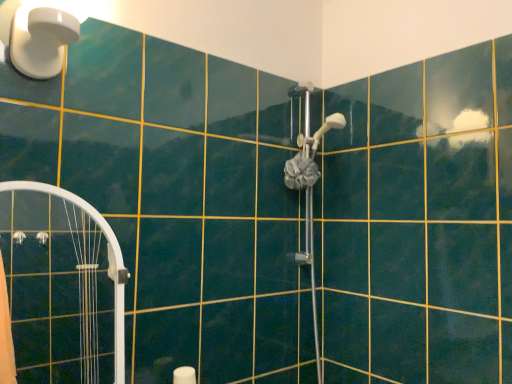
What is the approximate height of satin silver shower head at center, marked as the second shower in a top-to-bottom arrangement?

satin silver shower head at center, marked as the second shower in a top-to-bottom arrangement, is 1.08 meters in height.

What are the coordinates of `satin silver shower head at center, positioned as the 2th shower in bottom-to-top order` in the screenshot? It's located at (309, 156).

Based on the photo, are white glossy shower door at left and satin silver shower head at center, positioned as the 2th shower in bottom-to-top order, beside each other?

No, white glossy shower door at left is not touching satin silver shower head at center, positioned as the 2th shower in bottom-to-top order.

Which is closer to the camera, (56, 187) or (303, 154)?

The point (56, 187) is closer.

Considering the relative sizes of white glossy shower door at left and satin silver shower head at center, positioned as the 2th shower in bottom-to-top order, in the image provided, is white glossy shower door at left smaller than satin silver shower head at center, positioned as the 2th shower in bottom-to-top order,?

Actually, white glossy shower door at left might be larger than satin silver shower head at center, positioned as the 2th shower in bottom-to-top order.

Who is more distant, white glossy shower door at left or satin silver shower head at center, positioned as the 1th shower in top-to-bottom order?

satin silver shower head at center, positioned as the 1th shower in top-to-bottom order.

Looking at their sizes, would you say white plastic light fixture at upper left is wider or thinner than satin silver shower head at center, positioned as the 1th shower in top-to-bottom order?

In the image, white plastic light fixture at upper left appears to be wider than satin silver shower head at center, positioned as the 1th shower in top-to-bottom order.

From the image's perspective, is white plastic light fixture at upper left located above or below satin silver shower head at center, positioned as the 1th shower in top-to-bottom order?

From the image's perspective, white plastic light fixture at upper left appears above satin silver shower head at center, positioned as the 1th shower in top-to-bottom order.

Considering their positions, is white plastic light fixture at upper left located in front of or behind satin silver shower head at center, positioned as the 2th shower in bottom-to-top order?

Visually, white plastic light fixture at upper left is located in front of satin silver shower head at center, positioned as the 2th shower in bottom-to-top order.

How different are the orientations of white plastic light fixture at upper left and satin silver shower head at center, positioned as the 1th shower in top-to-bottom order, in degrees?

1.2 degrees.

Who is more distant, satin silver shower head at center, marked as the second shower in a top-to-bottom arrangement, or white plastic light fixture at upper left?

Positioned behind is satin silver shower head at center, marked as the second shower in a top-to-bottom arrangement.

Is point (298, 172) more distant than point (59, 44)?

Yes, it is.

Can you see satin silver shower head at center, marked as the first shower in a bottom-to-top arrangement, touching white plastic light fixture at upper left?

No, satin silver shower head at center, marked as the first shower in a bottom-to-top arrangement, is not with white plastic light fixture at upper left.

Is satin silver shower head at center, marked as the second shower in a top-to-bottom arrangement, looking in the opposite direction of white plastic light fixture at upper left?

No, satin silver shower head at center, marked as the second shower in a top-to-bottom arrangement, is not facing the opposite direction of white plastic light fixture at upper left.

Is satin silver shower head at center, marked as the second shower in a top-to-bottom arrangement, to the left or to the right of white glossy shower door at left in the image?

In the image, satin silver shower head at center, marked as the second shower in a top-to-bottom arrangement, appears on the right side of white glossy shower door at left.

From a real-world perspective, is satin silver shower head at center, marked as the first shower in a bottom-to-top arrangement, over white glossy shower door at left?

Yes, from a real-world perspective, satin silver shower head at center, marked as the first shower in a bottom-to-top arrangement, is over white glossy shower door at left

From the image's perspective, is satin silver shower head at center, marked as the first shower in a bottom-to-top arrangement, above or below white glossy shower door at left?

satin silver shower head at center, marked as the first shower in a bottom-to-top arrangement, is situated higher than white glossy shower door at left in the image.

Can we say satin silver shower head at center, marked as the first shower in a bottom-to-top arrangement, lies outside satin silver shower head at center, positioned as the 1th shower in top-to-bottom order?

Yes, satin silver shower head at center, marked as the first shower in a bottom-to-top arrangement, is not within satin silver shower head at center, positioned as the 1th shower in top-to-bottom order.

From the image's perspective, is satin silver shower head at center, marked as the first shower in a bottom-to-top arrangement, located above or below satin silver shower head at center, positioned as the 2th shower in bottom-to-top order?

satin silver shower head at center, marked as the first shower in a bottom-to-top arrangement, is below satin silver shower head at center, positioned as the 2th shower in bottom-to-top order.

Considering the relative sizes of satin silver shower head at center, marked as the second shower in a top-to-bottom arrangement, and satin silver shower head at center, positioned as the 1th shower in top-to-bottom order, in the image provided, is satin silver shower head at center, marked as the second shower in a top-to-bottom arrangement, thinner than satin silver shower head at center, positioned as the 1th shower in top-to-bottom order,?

Incorrect, the width of satin silver shower head at center, marked as the second shower in a top-to-bottom arrangement, is not less than that of satin silver shower head at center, positioned as the 1th shower in top-to-bottom order.

Considering the positions of point (312, 238) and point (320, 139), is point (312, 238) closer or farther from the camera than point (320, 139)?

Clearly, point (312, 238) is more distant from the camera than point (320, 139).

Which object is further away from the camera, white plastic light fixture at upper left or satin silver shower head at center, marked as the second shower in a top-to-bottom arrangement?

satin silver shower head at center, marked as the second shower in a top-to-bottom arrangement, is further away from the camera.

Between white plastic light fixture at upper left and satin silver shower head at center, marked as the first shower in a bottom-to-top arrangement, which one has more height?

Standing taller between the two is satin silver shower head at center, marked as the first shower in a bottom-to-top arrangement.

Considering the relative sizes of white plastic light fixture at upper left and satin silver shower head at center, marked as the first shower in a bottom-to-top arrangement, in the image provided, is white plastic light fixture at upper left bigger than satin silver shower head at center, marked as the first shower in a bottom-to-top arrangement,?

Actually, white plastic light fixture at upper left might be smaller than satin silver shower head at center, marked as the first shower in a bottom-to-top arrangement.

How far apart are white plastic light fixture at upper left and satin silver shower head at center, marked as the first shower in a bottom-to-top arrangement?

The distance of white plastic light fixture at upper left from satin silver shower head at center, marked as the first shower in a bottom-to-top arrangement, is 33.37 inches.

Based on the photo, what's the angular difference between white glossy shower door at left and white plastic light fixture at upper left's facing directions?

The angle between the facing direction of white glossy shower door at left and the facing direction of white plastic light fixture at upper left is 0.146 degrees.

Which object is thinner, white glossy shower door at left or white plastic light fixture at upper left?

Thinner between the two is white glossy shower door at left.

The width and height of the screenshot is (512, 384). Find the location of `light fixture in front of the white glossy shower door at left`. light fixture in front of the white glossy shower door at left is located at coordinates (38, 36).

From the image's perspective, would you say white glossy shower door at left is positioned over white plastic light fixture at upper left?

No.

Locate an element on the screen. The height and width of the screenshot is (384, 512). shower that is the 2nd object above the white glossy shower door at left (from a real-world perspective) is located at coordinates (309, 156).

The width and height of the screenshot is (512, 384). Identify the location of light fixture that is on the left side of satin silver shower head at center, positioned as the 1th shower in top-to-bottom order. (38, 36).

Which object lies further to the anchor point white glossy shower door at left, satin silver shower head at center, marked as the first shower in a bottom-to-top arrangement, or white plastic light fixture at upper left?

satin silver shower head at center, marked as the first shower in a bottom-to-top arrangement.

Looking at the image, which one is located closer to satin silver shower head at center, positioned as the 2th shower in bottom-to-top order, white glossy shower door at left or white plastic light fixture at upper left?

white glossy shower door at left is positioned closer to the anchor satin silver shower head at center, positioned as the 2th shower in bottom-to-top order.

Considering their positions, is satin silver shower head at center, positioned as the 2th shower in bottom-to-top order, positioned closer to white glossy shower door at left than white plastic light fixture at upper left?

white plastic light fixture at upper left is positioned closer to the anchor white glossy shower door at left.

Considering their positions, is satin silver shower head at center, marked as the second shower in a top-to-bottom arrangement, positioned closer to satin silver shower head at center, positioned as the 1th shower in top-to-bottom order, than white glossy shower door at left?

The object closer to satin silver shower head at center, positioned as the 1th shower in top-to-bottom order, is satin silver shower head at center, marked as the second shower in a top-to-bottom arrangement.

Estimate the real-world distances between objects in this image. Which object is further from satin silver shower head at center, marked as the second shower in a top-to-bottom arrangement, satin silver shower head at center, positioned as the 1th shower in top-to-bottom order, or white plastic light fixture at upper left?

white plastic light fixture at upper left.

Looking at the image, which one is located closer to satin silver shower head at center, marked as the first shower in a bottom-to-top arrangement, white glossy shower door at left or white plastic light fixture at upper left?

Among the two, white glossy shower door at left is located nearer to satin silver shower head at center, marked as the first shower in a bottom-to-top arrangement.

When comparing their distances from white plastic light fixture at upper left, does satin silver shower head at center, positioned as the 2th shower in bottom-to-top order, or white glossy shower door at left seem closer?

white glossy shower door at left.

From the image, which object appears to be nearer to satin silver shower head at center, marked as the second shower in a top-to-bottom arrangement, white glossy shower door at left or satin silver shower head at center, positioned as the 2th shower in bottom-to-top order?

satin silver shower head at center, positioned as the 2th shower in bottom-to-top order, is closer to satin silver shower head at center, marked as the second shower in a top-to-bottom arrangement.

Where is `shower between white plastic light fixture at upper left and satin silver shower head at center, marked as the first shower in a bottom-to-top arrangement, in the horizontal direction`? The image size is (512, 384). shower between white plastic light fixture at upper left and satin silver shower head at center, marked as the first shower in a bottom-to-top arrangement, in the horizontal direction is located at coordinates (309, 156).

Identify the location of shower door between white plastic light fixture at upper left and satin silver shower head at center, marked as the second shower in a top-to-bottom arrangement. The image size is (512, 384). (108, 260).

This screenshot has width=512, height=384. What are the coordinates of `shower located between white glossy shower door at left and satin silver shower head at center, marked as the first shower in a bottom-to-top arrangement, in the left-right direction` in the screenshot? It's located at (309, 156).

At what (x,y) coordinates should I click in order to perform the action: click on shower door between white plastic light fixture at upper left and satin silver shower head at center, positioned as the 2th shower in bottom-to-top order, in the horizontal direction. Please return your answer as a coordinate pair (x, y). The width and height of the screenshot is (512, 384). Looking at the image, I should click on (108, 260).